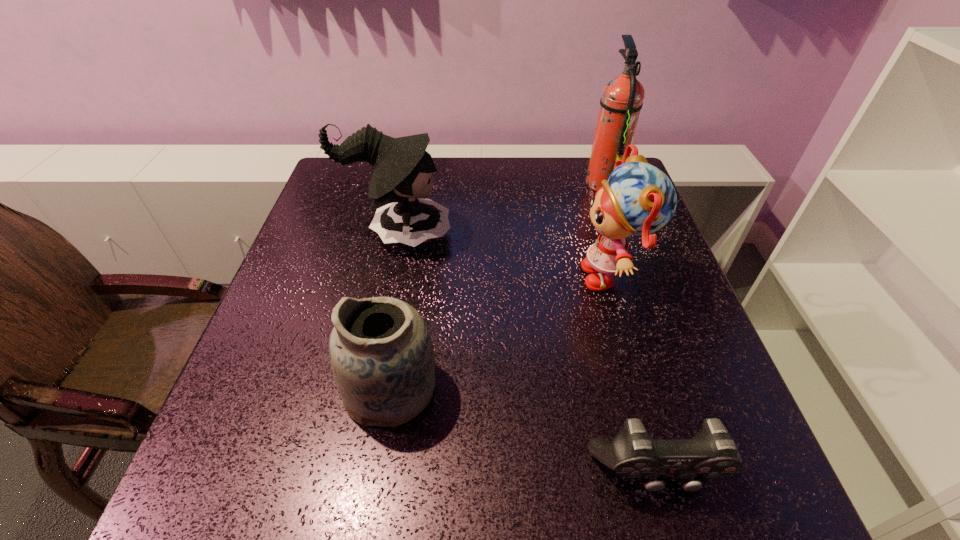
I want to click on fire extinguisher, so click(622, 97).

Find the location of a particular element. the tallest object is located at coordinates (622, 97).

Locate an element on the screen. Image resolution: width=960 pixels, height=540 pixels. the left doll is located at coordinates (401, 172).

Locate an element on the screen. the right doll is located at coordinates (638, 199).

You are a GUI agent. You are given a task and a screenshot of the screen. Output one action in this format:
    pyautogui.click(x=<x>, y=<y>)
    Task: Click on the second shortest object
    
    Given the screenshot: What is the action you would take?
    pyautogui.click(x=382, y=357)

You are a GUI agent. You are given a task and a screenshot of the screen. Output one action in this format:
    pyautogui.click(x=<x>, y=<y>)
    Task: Click on the second nearest object
    
    Given the screenshot: What is the action you would take?
    pyautogui.click(x=382, y=357)

Identify the location of the nearest object. (711, 453).

Image resolution: width=960 pixels, height=540 pixels. Find the location of `the shortest object`. the shortest object is located at coordinates (711, 453).

The height and width of the screenshot is (540, 960). I want to click on free spot located at the nozzle of the tallest object, so click(x=499, y=182).

Where is `vacant point located at the nozzle of the tallest object`? The height and width of the screenshot is (540, 960). vacant point located at the nozzle of the tallest object is located at coordinates (482, 182).